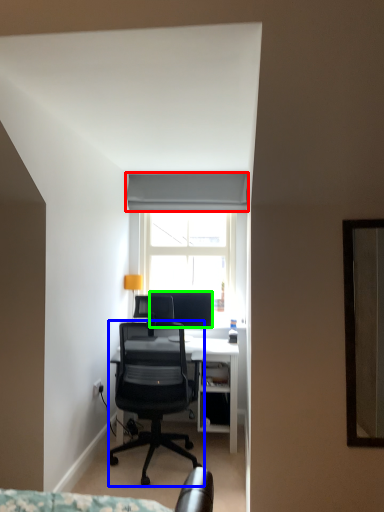
Question: Based on their relative distances, which object is nearer to curtain (highlighted by a red box)? Choose from chair (highlighted by a blue box) and television (highlighted by a green box).

Choices:
 (A) chair
 (B) television

Answer: (B)